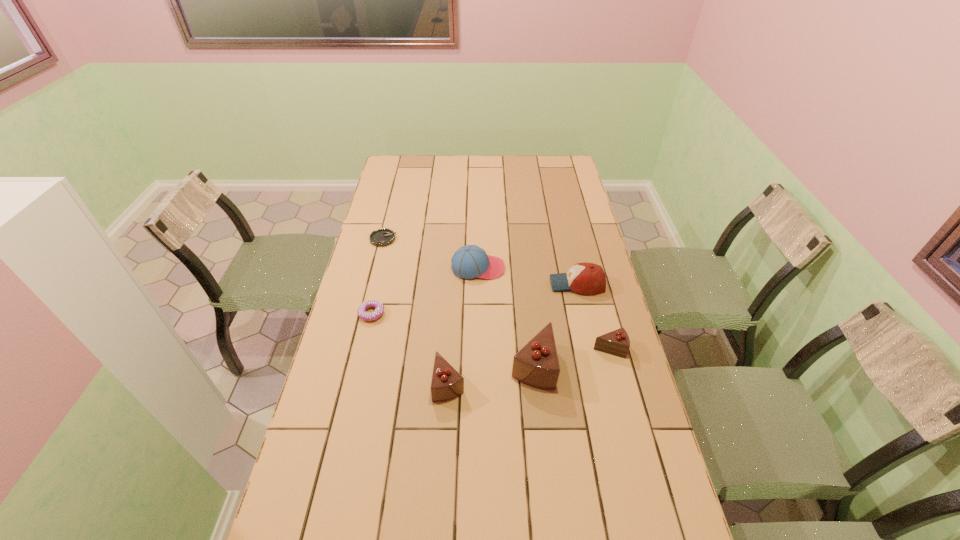
Image resolution: width=960 pixels, height=540 pixels. In order to click on ashtray in this screenshot , I will do `click(382, 237)`.

This screenshot has width=960, height=540. Find the location of `vacant space located on the right of the leftmost chocolate cake`. vacant space located on the right of the leftmost chocolate cake is located at coordinates click(519, 383).

This screenshot has height=540, width=960. Find the location of `vacant space located 0.150m on the front of the third object from right to left`. vacant space located 0.150m on the front of the third object from right to left is located at coordinates (540, 441).

Image resolution: width=960 pixels, height=540 pixels. I want to click on free spot located on the left of the fifth tallest object, so (x=548, y=348).

Where is `blank space located on the front of the fourth nearest object`? This screenshot has height=540, width=960. blank space located on the front of the fourth nearest object is located at coordinates (356, 378).

This screenshot has height=540, width=960. I want to click on free location located on the front-facing side of the left baseball cap, so click(568, 268).

You are a GUI agent. You are given a task and a screenshot of the screen. Output one action in this format:
    pyautogui.click(x=<x>, y=<y>)
    Task: Click on the blank area located 0.260m on the front-facing side of the right baseball cap
    This screenshot has height=540, width=960.
    Given the screenshot: What is the action you would take?
    pyautogui.click(x=477, y=284)

At what (x,y) coordinates should I click in order to perform the action: click on free space located on the front-facing side of the right baseball cap. Please return your answer as a coordinate pair (x, y). The height and width of the screenshot is (540, 960). Looking at the image, I should click on (464, 284).

Find the location of `free point located on the front-facing side of the right baseball cap`. free point located on the front-facing side of the right baseball cap is located at coordinates (442, 284).

Find the location of a particular element. This screenshot has width=960, height=540. vacant area situated on the right of the farthest object is located at coordinates [495, 239].